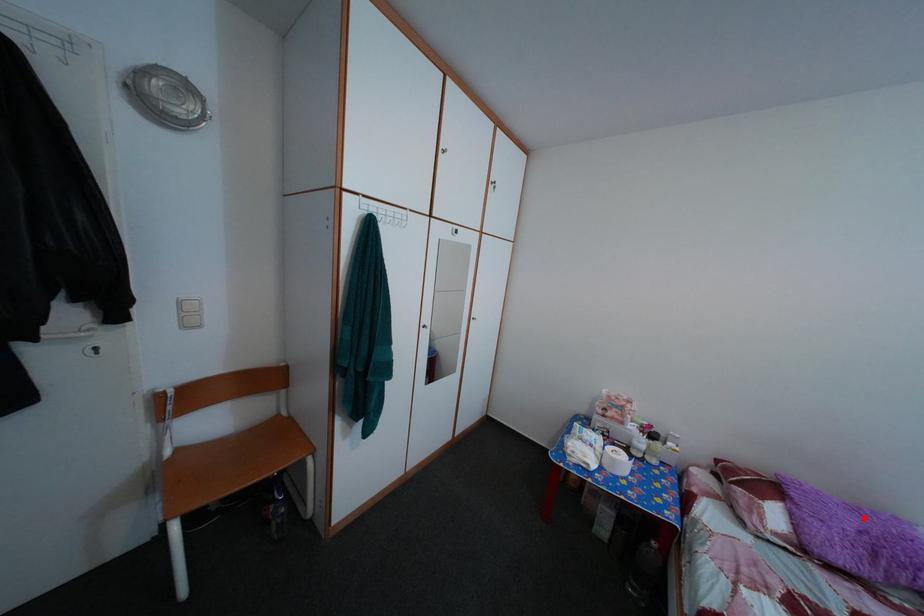
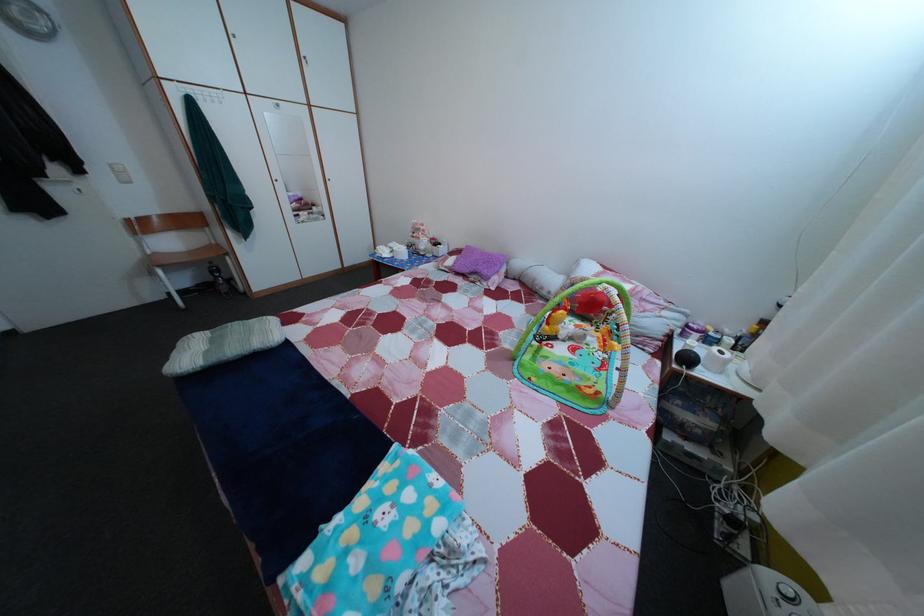
Find the pixel in the second image that matches the highlighted location in the first image.

(492, 261)